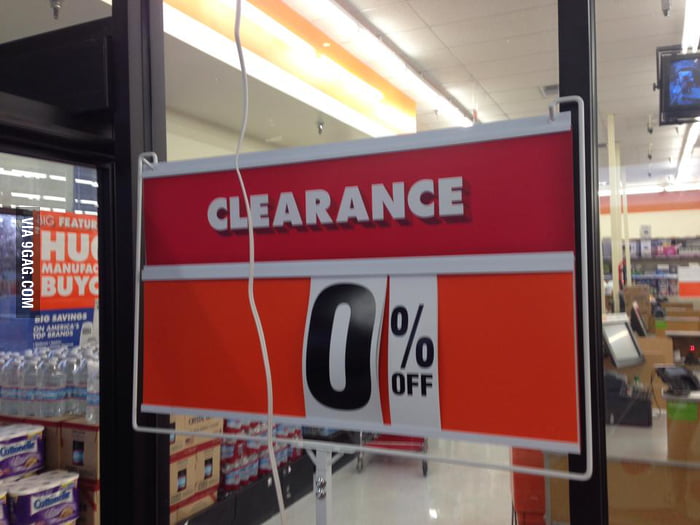
Find the location of `floor`. floor is located at coordinates (451, 482).